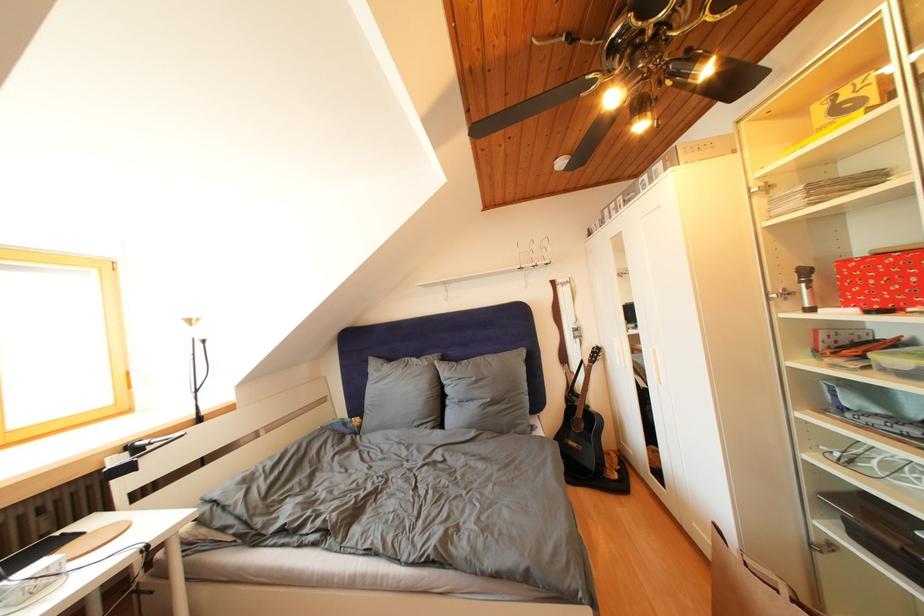
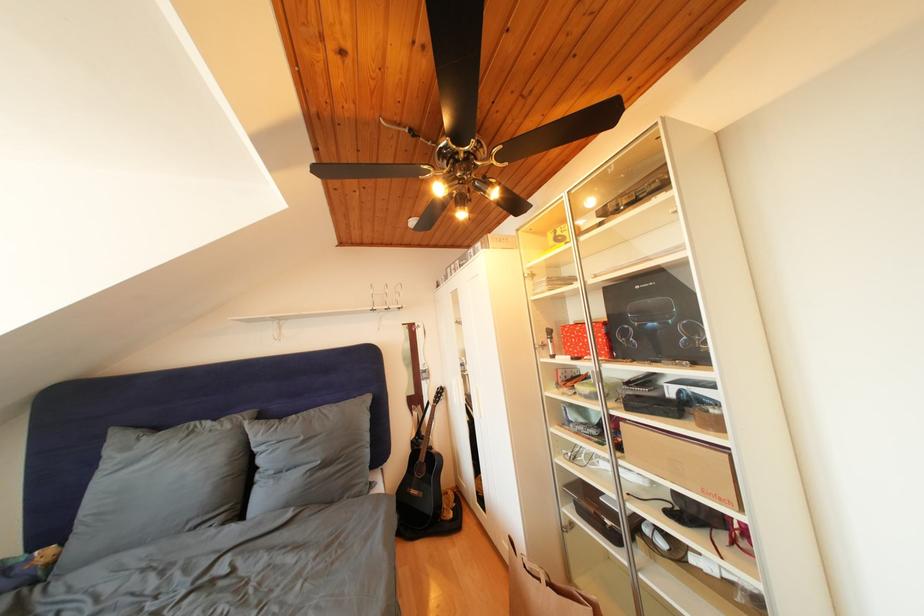
Where in the second image is the point corresponding to (433,369) from the first image?

(236, 432)